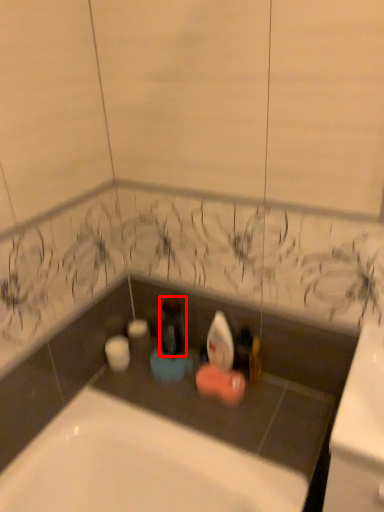
Question: From the image's perspective, considering the relative positions of bottle (annotated by the red box) and toiletry in the image provided, where is bottle (annotated by the red box) located with respect to the staircase?

Choices:
 (A) below
 (B) above

Answer: (B)